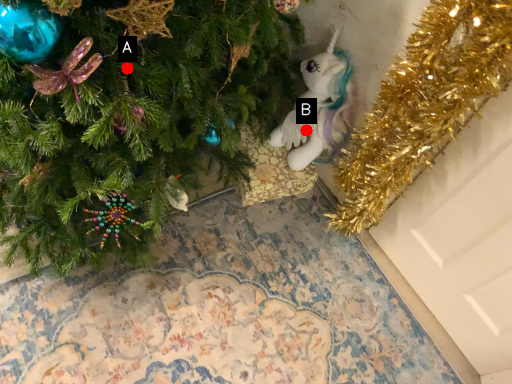
Question: Two points are circled on the image, labeled by A and B beside each circle. Which point is closer to the camera taking this photo?

Choices:
 (A) A is closer
 (B) B is closer

Answer: (A)